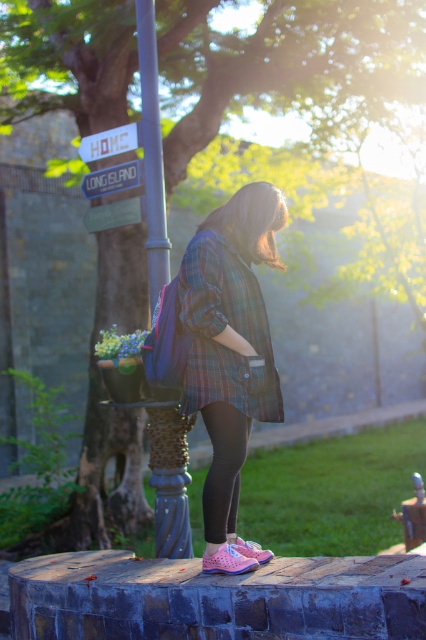
Based on the photo, is black leggings at lower center positioned at the back of green painted metal street sign at upper left?

No, it is not.

Who is more distant from viewer, (216,444) or (140,209)?

Point (140,209)

Find the location of a particular element. The width and height of the screenshot is (426, 640). black leggings at lower center is located at coordinates (224, 467).

What are the coordinates of `plaid fabric jacket at center` in the screenshot? It's located at (230, 355).

Locate an element on the screen. The image size is (426, 640). plaid fabric jacket at center is located at coordinates (230, 355).

Does point (241, 376) come behind point (253, 292)?

That is False.

Which is in front, point (204, 378) or point (221, 376)?

Positioned in front is point (221, 376).

The image size is (426, 640). What are the coordinates of `plaid fabric jacket at center` in the screenshot? It's located at (230, 355).